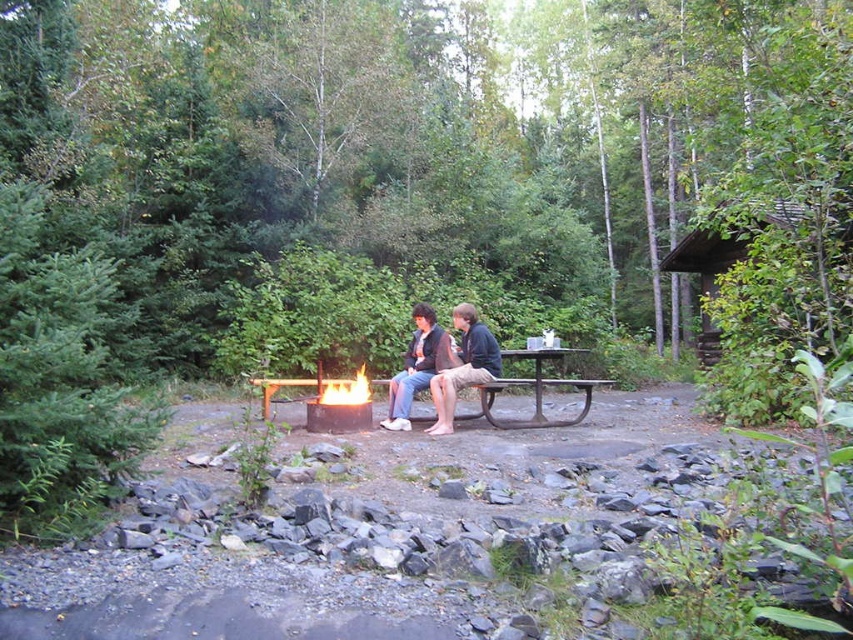
Question: Does metallic dark brown picnic table at center come behind flamematerial/texturefire at center?

Choices:
 (A) no
 (B) yes

Answer: (B)

Question: Which object appears closest to the camera in this image?

Choices:
 (A) dark brown leather jacket at center
 (B) metallic dark brown picnic table at center
 (C) brown wooden cabin at upper right

Answer: (A)

Question: In this image, where is metallic dark brown picnic table at center located relative to flamematerial/texturefire at center?

Choices:
 (A) left
 (B) right

Answer: (B)

Question: Estimate the real-world distances between objects in this image. Which object is closer to the brown wooden cabin at upper right?

Choices:
 (A) flamematerial/texturefire at center
 (B) dark brown leather jacket at center
 (C) metallic dark brown picnic table at center

Answer: (C)

Question: Is dark brown leather jacket at center above flamematerial/texturefire at center?

Choices:
 (A) no
 (B) yes

Answer: (B)

Question: Which point is farther from the camera taking this photo?

Choices:
 (A) (399, 376)
 (B) (357, 403)
 (C) (715, 269)
 (D) (585, 387)

Answer: (C)